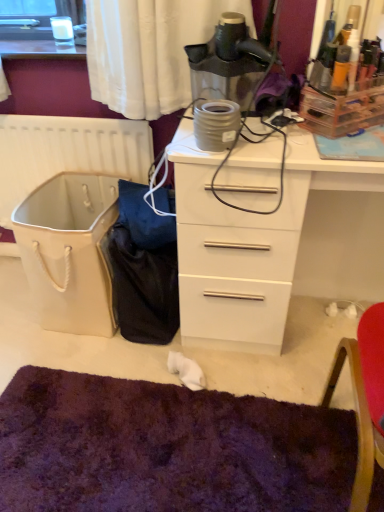
Question: From a real-world perspective, is matte black hairdryer at upper center on purple shaggy mat at lower center?

Choices:
 (A) no
 (B) yes

Answer: (B)

Question: Is matte black hairdryer at upper center thinner than purple shaggy mat at lower center?

Choices:
 (A) no
 (B) yes

Answer: (B)

Question: From a real-world perspective, is matte black hairdryer at upper center physically below purple shaggy mat at lower center?

Choices:
 (A) no
 (B) yes

Answer: (A)

Question: From the image's perspective, is matte black hairdryer at upper center above purple shaggy mat at lower center?

Choices:
 (A) yes
 (B) no

Answer: (A)

Question: Is purple shaggy mat at lower center a part of matte black hairdryer at upper center?

Choices:
 (A) yes
 (B) no

Answer: (B)

Question: Is the depth of matte black hairdryer at upper center greater than that of purple shaggy mat at lower center?

Choices:
 (A) yes
 (B) no

Answer: (A)

Question: Can you confirm if white plastic radiator at left is shorter than white glossy chest of drawers at center?

Choices:
 (A) no
 (B) yes

Answer: (B)

Question: Is white plastic radiator at left aimed at white glossy chest of drawers at center?

Choices:
 (A) no
 (B) yes

Answer: (A)

Question: Can you confirm if white plastic radiator at left is wider than white glossy chest of drawers at center?

Choices:
 (A) yes
 (B) no

Answer: (B)

Question: Is white plastic radiator at left completely or partially outside of white glossy chest of drawers at center?

Choices:
 (A) no
 (B) yes

Answer: (B)

Question: Does white plastic radiator at left appear on the left side of white glossy chest of drawers at center?

Choices:
 (A) no
 (B) yes

Answer: (B)

Question: Could white glossy chest of drawers at center be considered to be inside white plastic radiator at left?

Choices:
 (A) no
 (B) yes

Answer: (A)

Question: Is white plastic radiator at left a part of purple shaggy mat at lower center?

Choices:
 (A) no
 (B) yes

Answer: (A)